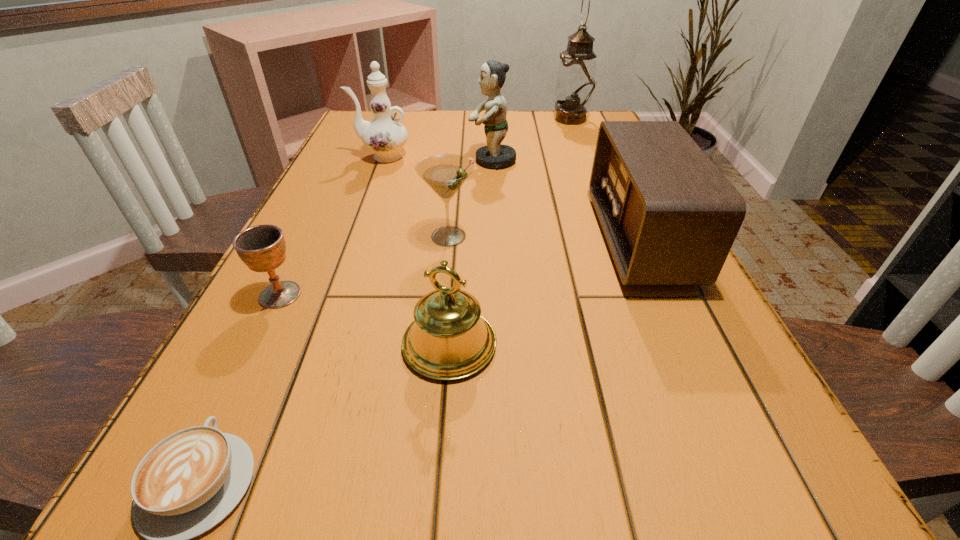
You are a GUI agent. You are given a task and a screenshot of the screen. Output one action in this format:
    pyautogui.click(x=<x>, y=<y>)
    Task: Click on the chinaware situated at the left edge
    
    Given the screenshot: What is the action you would take?
    pyautogui.click(x=385, y=136)

You are a GUI agent. You are given a task and a screenshot of the screen. Output one action in this format:
    pyautogui.click(x=<x>, y=<y>)
    Task: Click on the chalice present at the left edge
    The width and height of the screenshot is (960, 540).
    Given the screenshot: What is the action you would take?
    pyautogui.click(x=262, y=248)

I want to click on oil lamp located at the right edge, so click(x=576, y=82).

This screenshot has height=540, width=960. What are the coordinates of `radio receiver situated at the right edge` in the screenshot? It's located at (670, 217).

At what (x,y) coordinates should I click in order to perform the action: click on object that is at the far right corner. Please return your answer as a coordinate pair (x, y). The width and height of the screenshot is (960, 540). Looking at the image, I should click on (576, 82).

Identify the location of free space at the far edge of the desktop. This screenshot has width=960, height=540. (445, 125).

This screenshot has height=540, width=960. Find the location of `free space at the near edge`. free space at the near edge is located at coordinates (503, 494).

In the image, there is a desktop. What are the coordinates of `vacant space at the left edge` in the screenshot? It's located at (362, 179).

Locate an element on the screen. free space at the right edge of the desktop is located at coordinates (584, 177).

This screenshot has height=540, width=960. In the image, there is a desktop. Find the location of `free space at the far right corner`. free space at the far right corner is located at coordinates (600, 113).